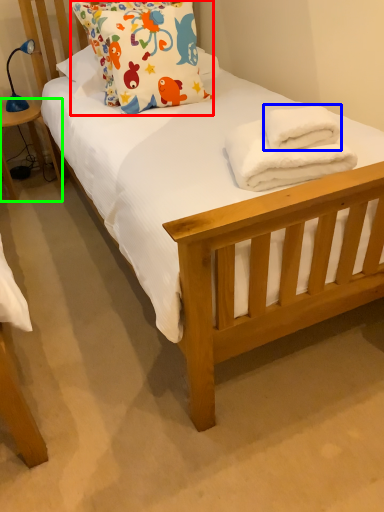
Question: Based on their relative distances, which object is nearer to pillow (highlighted by a red box)? Choose from bath towel (highlighted by a blue box) and table (highlighted by a green box).

Choices:
 (A) bath towel
 (B) table

Answer: (A)